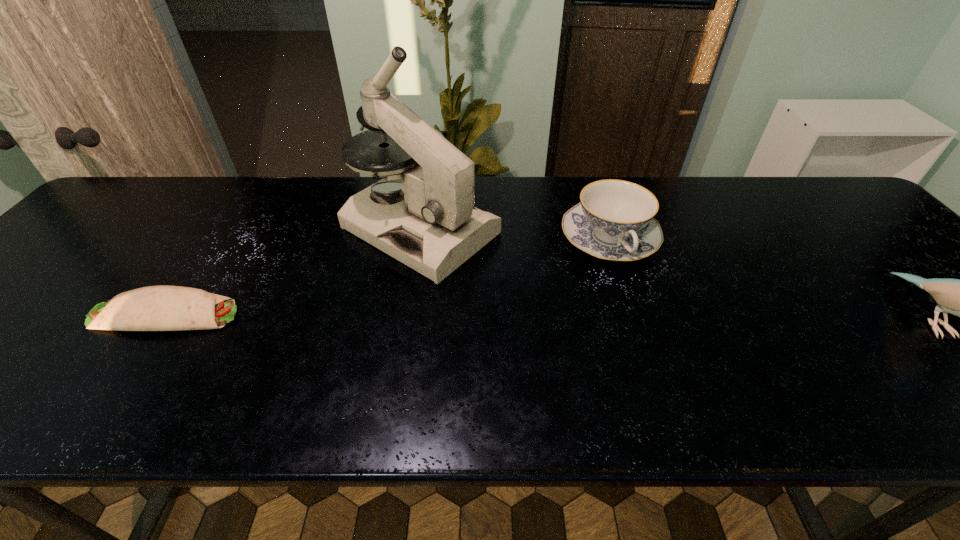
The image size is (960, 540). In order to click on free space located with the handle on the side of the chinaware in this screenshot , I will do `click(649, 304)`.

This screenshot has height=540, width=960. What are the coordinates of `vacant region located with the handle on the side of the chinaware` in the screenshot? It's located at (658, 317).

Image resolution: width=960 pixels, height=540 pixels. I want to click on vacant area situated 0.250m with the handle on the side of the chinaware, so click(683, 357).

The height and width of the screenshot is (540, 960). Identify the location of microscope that is at the far edge. (432, 226).

Locate an element on the screen. The height and width of the screenshot is (540, 960). chinaware located in the far edge section of the desktop is located at coordinates (614, 221).

In the image, there is a desktop. At what (x,y) coordinates should I click in order to perform the action: click on vacant space at the far edge. Please return your answer as a coordinate pair (x, y). The height and width of the screenshot is (540, 960). Looking at the image, I should click on [x=220, y=215].

The width and height of the screenshot is (960, 540). I want to click on vacant space at the near edge of the desktop, so click(x=615, y=354).

Where is `free space at the right edge`? The width and height of the screenshot is (960, 540). free space at the right edge is located at coordinates (901, 296).

The height and width of the screenshot is (540, 960). I want to click on vacant space at the near left corner of the desktop, so click(x=22, y=363).

Where is `vacant point at the far right corner`? vacant point at the far right corner is located at coordinates (838, 218).